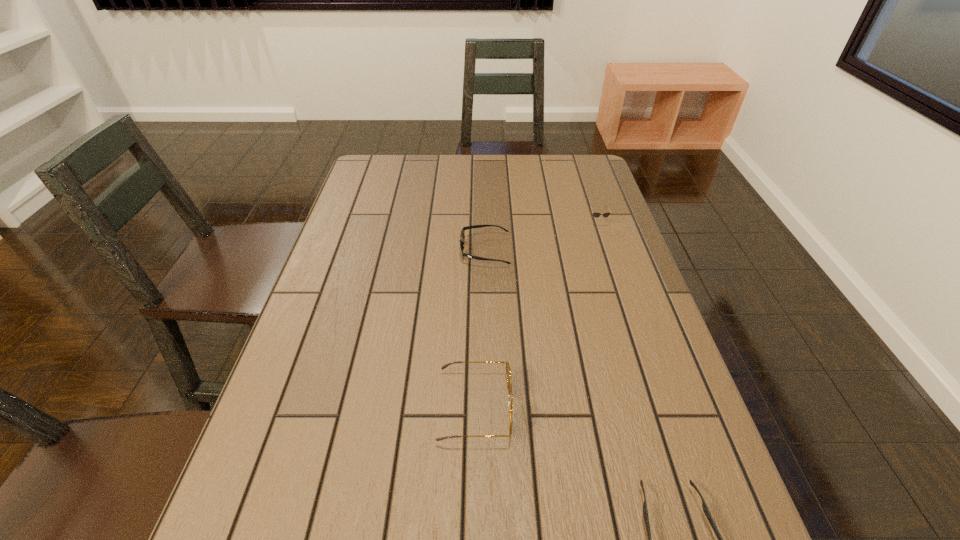
Where is `the third farthest object`? the third farthest object is located at coordinates (508, 372).

Find the location of a particular element. the third shortest object is located at coordinates (596, 214).

Image resolution: width=960 pixels, height=540 pixels. What are the coordinates of `the farthest sunglasses` in the screenshot? It's located at (596, 214).

You are a GUI agent. You are given a task and a screenshot of the screen. Output one action in this format:
    pyautogui.click(x=<x>, y=<y>)
    Task: Click on the third nearest object
    The image size is (960, 540).
    Given the screenshot: What is the action you would take?
    pyautogui.click(x=462, y=236)

Where is `vacant space situated on the lenses of the third farthest object`? The image size is (960, 540). vacant space situated on the lenses of the third farthest object is located at coordinates (668, 407).

You are a GUI agent. You are given a task and a screenshot of the screen. Output one action in this format:
    pyautogui.click(x=<x>, y=<y>)
    Task: Click on the vacant space located in front of the lenses of the third shortest object
    Image resolution: width=960 pixels, height=540 pixels.
    Given the screenshot: What is the action you would take?
    pyautogui.click(x=610, y=261)

The image size is (960, 540). In order to click on vacant space situated 0.350m on the front-facing side of the second farthest sunglasses in this screenshot , I will do `click(335, 250)`.

Locate an element on the screen. The height and width of the screenshot is (540, 960). free point located 0.170m on the front-facing side of the second farthest sunglasses is located at coordinates (399, 250).

This screenshot has width=960, height=540. What are the coordinates of `vacant space located on the front-facing side of the second farthest sunglasses` in the screenshot? It's located at (396, 250).

Find the location of a particular element. Image resolution: width=960 pixels, height=540 pixels. object present at the right edge is located at coordinates (596, 214).